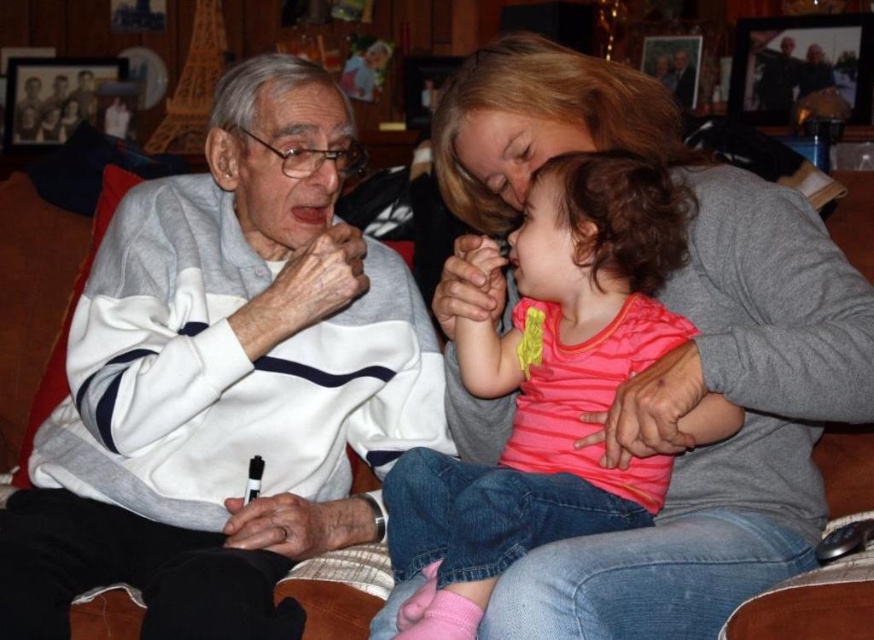
Question: Which object appears closest to the camera in this image?

Choices:
 (A) pink striped shirt at center
 (B) white matte sweater at left

Answer: (A)

Question: Is white matte sweater at left smaller than pink striped shirt at center?

Choices:
 (A) no
 (B) yes

Answer: (A)

Question: Observing the image, what is the correct spatial positioning of white matte sweater at left in reference to pink striped shirt at center?

Choices:
 (A) above
 (B) below

Answer: (A)

Question: From the image, what is the correct spatial relationship of white matte sweater at left in relation to pink striped shirt at center?

Choices:
 (A) left
 (B) right

Answer: (A)